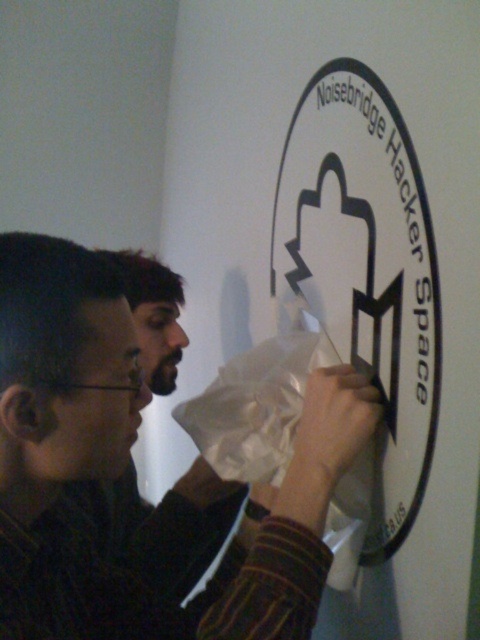
Question: Which object is the farthest from the white matte paper bag at center?

Choices:
 (A) white matte sign at upper center
 (B) matte black shirt at center

Answer: (B)

Question: Does matte black shirt at center appear on the right side of white matte paper bag at center?

Choices:
 (A) no
 (B) yes

Answer: (A)

Question: Is matte black shirt at center wider than white matte sign at upper center?

Choices:
 (A) no
 (B) yes

Answer: (B)

Question: Which point is closer to the camera?

Choices:
 (A) (355, 250)
 (B) (72, 384)

Answer: (B)

Question: Is matte black shirt at center smaller than white matte sign at upper center?

Choices:
 (A) no
 (B) yes

Answer: (A)

Question: Which object appears farthest from the camera in this image?

Choices:
 (A) white matte sign at upper center
 (B) matte black shirt at center
 (C) white matte paper bag at center

Answer: (C)